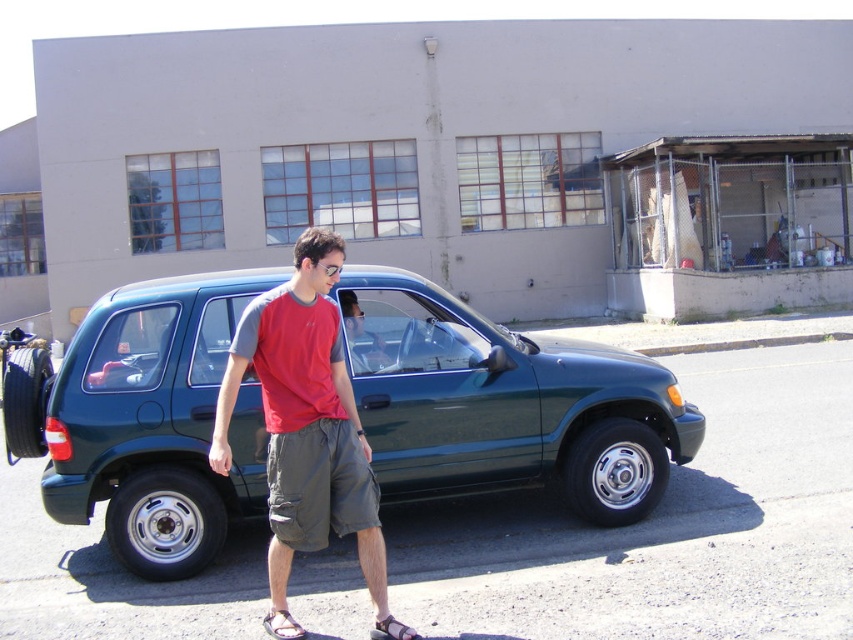
What is the spatial relationship between the green metallic minivan at center and the brown leather sandal at lower center?

The green metallic minivan at center is located above the brown leather sandal at lower center.

Consider the image. You are a delivery driver who needs to park your truck in a space that is exactly the width of the brown leather sandal at lower center. Can the green metallic minivan at center fit into this space? Please explain your reasoning.

The green metallic minivan at center is wider than the brown leather sandal at lower center. Since the parking space is only as wide as the sandal, the minivan cannot fit into the space.